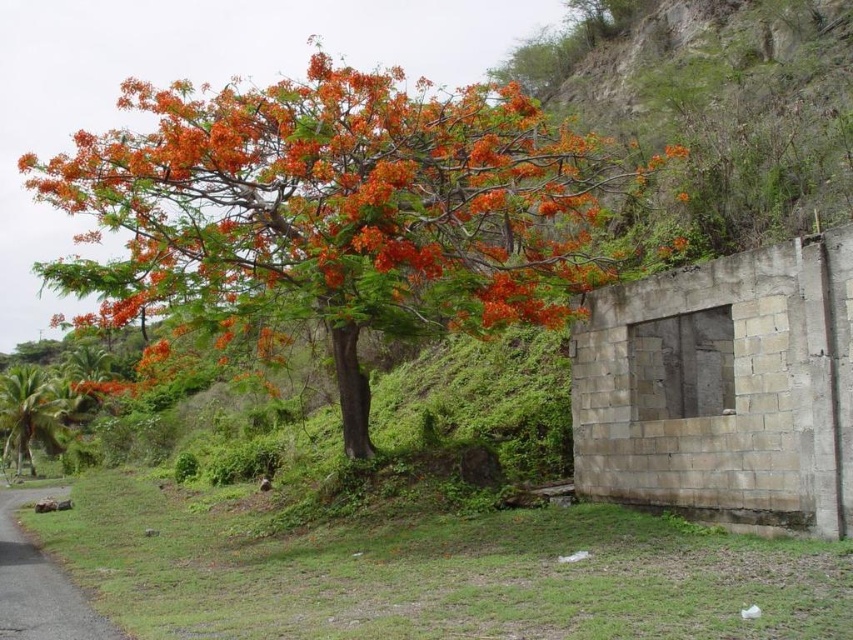
The image size is (853, 640). Describe the element at coordinates (339, 211) in the screenshot. I see `orange leafy tree at center` at that location.

Does point (239, 177) come closer to viewer compared to point (7, 412)?

That is True.

Who is more distant from viewer, (357, 380) or (12, 448)?

The point (12, 448) is behind.

The height and width of the screenshot is (640, 853). I want to click on orange leafy tree at center, so click(339, 211).